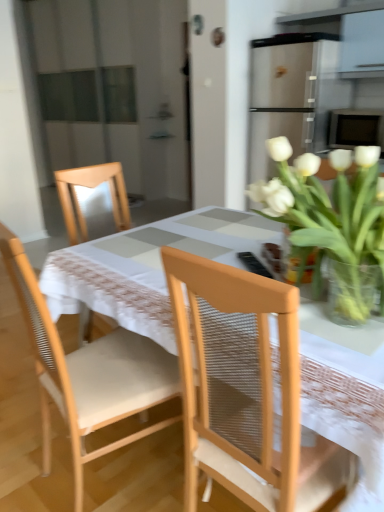
Question: From a real-world perspective, relative to wooden chair at center, acting as the 2th chair starting from the right, is light brown woven chair at center, the first chair from the right, vertically above or below?

Choices:
 (A) below
 (B) above

Answer: (B)

Question: In the image, is light brown woven chair at center, the first chair from the right, on the left side or the right side of wooden chair at center, placed as the first chair when sorted from left to right?

Choices:
 (A) left
 (B) right

Answer: (B)

Question: Estimate the real-world distances between objects in this image. Which object is closer to the wooden chair at center, placed as the first chair when sorted from left to right?

Choices:
 (A) white fabric table at center
 (B) light brown woven chair at center, the 2th chair from the left
 (C) clear glass vase at upper right
 (D) white glass vase at upper right

Answer: (B)

Question: Considering the real-world distances, which object is farthest from the light brown woven chair at center, the first chair from the right?

Choices:
 (A) wooden chair at center, acting as the 2th chair starting from the right
 (B) clear glass vase at upper right
 (C) white glass vase at upper right
 (D) white fabric table at center

Answer: (B)